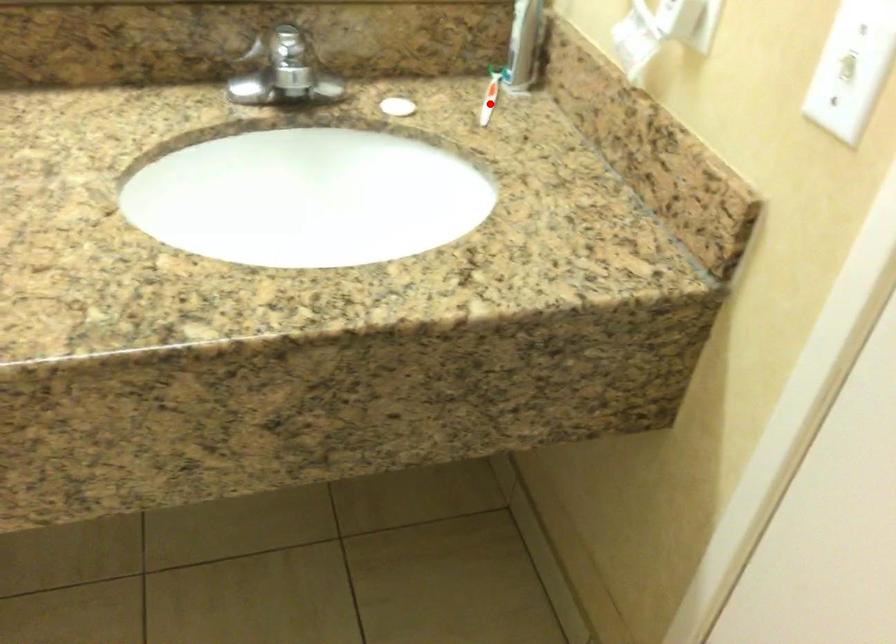
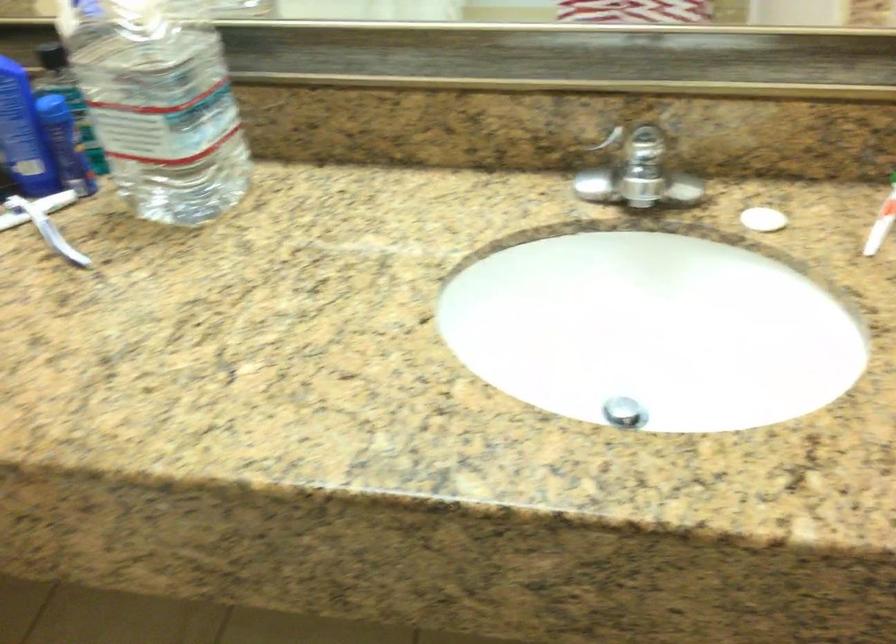
Question: I am providing you with two images of the same scene from different viewpoints. Given a red point in image1, look at the same physical point in image2. Is it:

Choices:
 (A) Closer to the viewpoint
 (B) Farther from the viewpoint

Answer: (A)